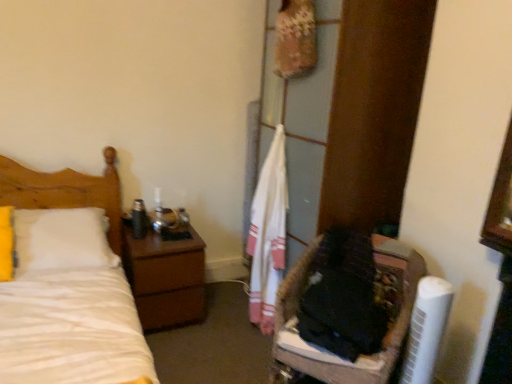
At what (x,y) coordinates should I click in order to perform the action: click on white matte bed at left. Please return your answer as a coordinate pair (x, y). Looking at the image, I should click on (65, 191).

The image size is (512, 384). What do you see at coordinates (65, 191) in the screenshot?
I see `white matte bed at left` at bounding box center [65, 191].

Describe the element at coordinates (384, 337) in the screenshot. I see `fuzzy fabric basket at lower right` at that location.

At what (x,y) coordinates should I click in order to perform the action: click on white cotton towel at center. Please return your answer as a coordinate pair (x, y). Looking at the image, I should click on (268, 234).

Considering the positions of objects fuzzy fabric basket at lower right and white matte bed at left in the image provided, who is more to the right, fuzzy fabric basket at lower right or white matte bed at left?

Positioned to the right is fuzzy fabric basket at lower right.

Can you confirm if fuzzy fabric basket at lower right is wider than white matte bed at left?

Correct, the width of fuzzy fabric basket at lower right exceeds that of white matte bed at left.

Does fuzzy fabric basket at lower right have a greater height compared to white matte bed at left?

Correct, fuzzy fabric basket at lower right is much taller as white matte bed at left.

Measure the distance between fuzzy fabric basket at lower right and white matte bed at left.

The distance of fuzzy fabric basket at lower right from white matte bed at left is 4.69 feet.

Considering the relative positions of white cotton towel at center and white matte bed at left in the image provided, is white cotton towel at center in front of white matte bed at left?

No, white cotton towel at center is further to the viewer.

Considering the relative sizes of white cotton towel at center and white matte bed at left in the image provided, is white cotton towel at center wider than white matte bed at left?

In fact, white cotton towel at center might be narrower than white matte bed at left.

Does white cotton towel at center turn towards white matte bed at left?

Yes, white cotton towel at center is oriented towards white matte bed at left.

Identify the location of bed directly beneath the white cotton towel at center (from a real-world perspective). This screenshot has height=384, width=512. (65, 191).

I want to click on bed above the white plastic air conditioner at lower right (from the image's perspective), so click(65, 191).

Does point (443, 324) come behind point (67, 204)?

That is False.

In the scene shown: Which object is further away from the camera, white plastic air conditioner at lower right or white matte bed at left?

white matte bed at left is further from the camera.

Who is shorter, brown wood nightstand at left or fuzzy fabric basket at lower right?

With less height is brown wood nightstand at left.

Between brown wood nightstand at left and fuzzy fabric basket at lower right, which one has smaller size?

brown wood nightstand at left.

I want to click on nightstand lying above the fuzzy fabric basket at lower right (from the image's perspective), so click(x=165, y=278).

Based on their positions, is white plastic air conditioner at lower right located to the left or right of fuzzy fabric basket at lower right?

Based on their positions, white plastic air conditioner at lower right is located to the right of fuzzy fabric basket at lower right.

Are white plastic air conditioner at lower right and fuzzy fabric basket at lower right far apart?

That's not correct — white plastic air conditioner at lower right is a little close to fuzzy fabric basket at lower right.

In order to click on furniture below the white plastic air conditioner at lower right (from the image's perspective) in this screenshot , I will do `click(384, 337)`.

From the image's perspective, is white plastic air conditioner at lower right positioned above or below fuzzy fabric basket at lower right?

white plastic air conditioner at lower right is above fuzzy fabric basket at lower right.

Is point (270, 311) positioned before point (435, 332)?

No, it is not.

Is white plastic air conditioner at lower right at the back of white cotton towel at center?

No, white plastic air conditioner at lower right is not at the back of white cotton towel at center.

From the image's perspective, does white cotton towel at center appear lower than white plastic air conditioner at lower right?

No, from the image's perspective, white cotton towel at center is not below white plastic air conditioner at lower right.

Can you see white cotton towel at center touching white plastic air conditioner at lower right?

No.

The width and height of the screenshot is (512, 384). I want to click on nightstand on the right of the white matte bed at left, so click(x=165, y=278).

Which of these two, brown wood nightstand at left or white matte bed at left, is thinner?

Thinner between the two is white matte bed at left.

In the scene shown: Which is in front, brown wood nightstand at left or white matte bed at left?

Positioned in front is white matte bed at left.

How different are the orientations of brown wood nightstand at left and white matte bed at left in degrees?

brown wood nightstand at left and white matte bed at left are facing 0.599 degrees away from each other.

At what (x,y) coordinates should I click in order to perform the action: click on furniture below the white matte bed at left (from the image's perspective). Please return your answer as a coordinate pair (x, y). The width and height of the screenshot is (512, 384). Looking at the image, I should click on (384, 337).

This screenshot has height=384, width=512. Identify the location of clothe above the white matte bed at left (from the image's perspective). (268, 234).

Estimate the real-world distances between objects in this image. Which object is further from brown wood nightstand at left, fuzzy fabric basket at lower right or white cotton towel at center?

Based on the image, fuzzy fabric basket at lower right appears to be further to brown wood nightstand at left.

From the image, which object appears to be nearer to white matte bed at left, white cotton towel at center or brown wood nightstand at left?

brown wood nightstand at left is closer to white matte bed at left.

Based on the photo, looking at the image, which one is located further to white matte bed at left, white cotton towel at center or fuzzy fabric basket at lower right?

Among the two, fuzzy fabric basket at lower right is located further to white matte bed at left.

Looking at this image, looking at the image, which one is located further to white matte bed at left, fuzzy fabric basket at lower right or white plastic air conditioner at lower right?

Based on the image, white plastic air conditioner at lower right appears to be further to white matte bed at left.

Considering their positions, is brown wood nightstand at left positioned further to white matte bed at left than white cotton towel at center?

The object further to white matte bed at left is white cotton towel at center.

Looking at the image, which one is located closer to brown wood nightstand at left, white cotton towel at center or white matte bed at left?

Among the two, white matte bed at left is located nearer to brown wood nightstand at left.

Looking at the image, which one is located closer to fuzzy fabric basket at lower right, brown wood nightstand at left or white plastic air conditioner at lower right?

white plastic air conditioner at lower right lies closer to fuzzy fabric basket at lower right than the other object.

When comparing their distances from fuzzy fabric basket at lower right, does white cotton towel at center or white matte bed at left seem further?

white matte bed at left lies further to fuzzy fabric basket at lower right than the other object.

The width and height of the screenshot is (512, 384). I want to click on furniture located between white plastic air conditioner at lower right and white cotton towel at center in the depth direction, so click(x=384, y=337).

Locate an element on the screen. The image size is (512, 384). clothe located between white matte bed at left and fuzzy fabric basket at lower right in the left-right direction is located at coordinates pos(268,234).

Where is `nightstand located between white matte bed at left and white cotton towel at center in the left-right direction`? Image resolution: width=512 pixels, height=384 pixels. nightstand located between white matte bed at left and white cotton towel at center in the left-right direction is located at coordinates (165, 278).

Where is `clothe located between brown wood nightstand at left and fuzzy fabric basket at lower right in the left-right direction`? clothe located between brown wood nightstand at left and fuzzy fabric basket at lower right in the left-right direction is located at coordinates (268, 234).